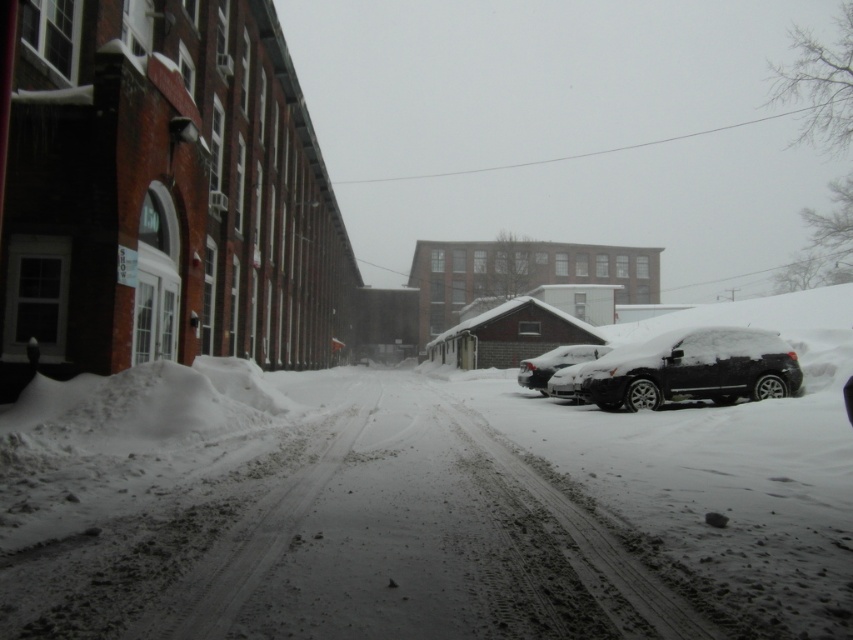
Who is more forward, (216, 440) or (709, 362)?

Point (216, 440) is in front.

Between point (180, 413) and point (766, 372), which one is positioned behind?

Positioned behind is point (766, 372).

Locate an element on the screen. The image size is (853, 640). white fluffy snow at center is located at coordinates (428, 500).

From the picture: Who is lower down, white fluffy snow at center or snow-covered suv at center?

snow-covered suv at center is below.

Can you confirm if white fluffy snow at center is positioned below snow-covered suv at center?

Actually, white fluffy snow at center is above snow-covered suv at center.

This screenshot has height=640, width=853. Identify the location of white fluffy snow at center. (428, 500).

Who is positioned more to the left, snow-covered suv at right or snow-covered suv at center?

Positioned to the left is snow-covered suv at center.

Between snow-covered suv at right and snow-covered suv at center, which one is positioned higher?

Positioned higher is snow-covered suv at right.

Between point (776, 392) and point (590, 346), which one is positioned in front?

Positioned in front is point (776, 392).

The width and height of the screenshot is (853, 640). Identify the location of snow-covered suv at right. (693, 369).